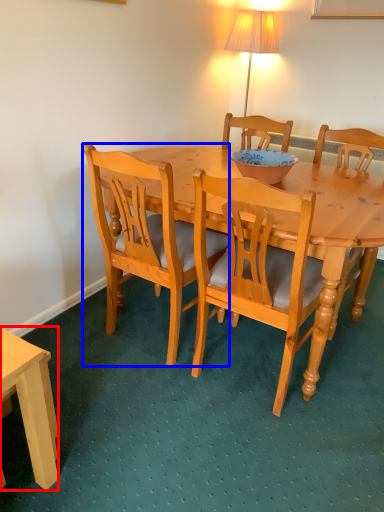
Question: Among these objects, which one is farthest to the camera, desk (highlighted by a red box) or chair (highlighted by a blue box)?

Choices:
 (A) desk
 (B) chair

Answer: (B)